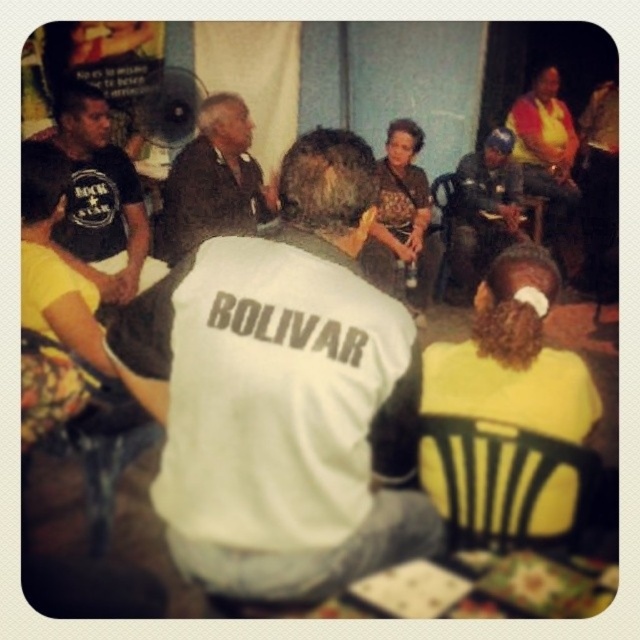
You are organizing a small event and need to know if the white fabric shirt at center can be placed on the black plastic chair at lower right. Based on the scene description, is this possible?

The white fabric shirt at center is positioned over the black plastic chair at lower right, so yes, it can be placed there.

You are a photographer trying to capture a candid shot of the blue helmet at center without including the dark brown leather jacket at center in the frame. Is this possible given their positions?

The dark brown leather jacket at center is closer to the viewer than the blue helmet at center, so it would block the view of the blue helmet at center. Therefore, capturing the blue helmet at center without the jacket in the frame is not possible.